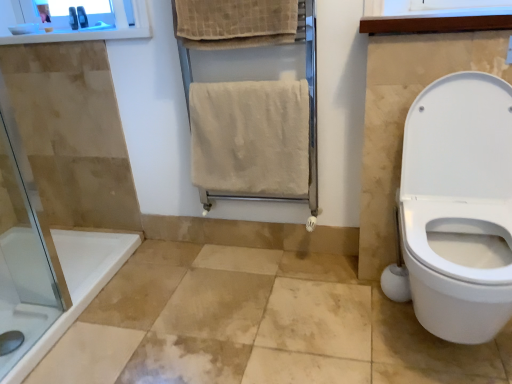
Describe the element at coordinates (250, 138) in the screenshot. This screenshot has height=384, width=512. I see `beige soft towel at center, which is the first bath towel from bottom to top` at that location.

Locate an element on the screen. This screenshot has height=384, width=512. white glossy toilet seat at right is located at coordinates (458, 207).

Describe the element at coordinates (312, 106) in the screenshot. I see `beige towel rack at center` at that location.

This screenshot has height=384, width=512. In order to click on white wood window frame at upper right in this screenshot , I will do `click(444, 7)`.

Measure the distance between point (424, 12) and camera.

4.36 feet.

In order to face beige textured towel at upper center, the 1th bath towel viewed from the top, should I rotate leftwards or rightwards?

You should look left and rotate roughly 2.733 degrees.

Find the location of a particular element. beige textured towel at upper center, the 2th bath towel ordered from the bottom is located at coordinates (234, 19).

Identify the location of wooden medicine cabinet at upper center. The image size is (512, 384). (431, 18).

Can you confirm if beige soft towel at center, the 2th bath towel in the top-to-bottom sequence, is thinner than wooden medicine cabinet at upper center?

Correct, the width of beige soft towel at center, the 2th bath towel in the top-to-bottom sequence, is less than that of wooden medicine cabinet at upper center.

Between beige soft towel at center, which is the first bath towel from bottom to top, and wooden medicine cabinet at upper center, which one appears on the left side from the viewer's perspective?

beige soft towel at center, which is the first bath towel from bottom to top, is more to the left.

Is beige soft towel at center, which is the first bath towel from bottom to top, aimed at wooden medicine cabinet at upper center?

No, beige soft towel at center, which is the first bath towel from bottom to top, is not aimed at wooden medicine cabinet at upper center.

From a real-world perspective, which is physically above, metallic gray razor at upper left, which appears as the second toiletry when viewed from the right, or white glossy toilet seat at right?

In real-world perspective, metallic gray razor at upper left, which appears as the second toiletry when viewed from the right, is above.

Which is more to the left, metallic gray razor at upper left, which appears as the second toiletry when viewed from the right, or white glossy toilet seat at right?

From the viewer's perspective, metallic gray razor at upper left, which appears as the second toiletry when viewed from the right, appears more on the left side.

Considering the relative sizes of metallic gray razor at upper left, which appears as the second toiletry when viewed from the right, and white glossy toilet seat at right in the image provided, is metallic gray razor at upper left, which appears as the second toiletry when viewed from the right, thinner than white glossy toilet seat at right?

Indeed, metallic gray razor at upper left, which appears as the second toiletry when viewed from the right, has a lesser width compared to white glossy toilet seat at right.

Can you tell me how much beige soft towel at center, which is the first bath towel from bottom to top, and metallic gray razor at upper left, arranged as the first toiletry when viewed from the left, differ in facing direction?

The facing directions of beige soft towel at center, which is the first bath towel from bottom to top, and metallic gray razor at upper left, arranged as the first toiletry when viewed from the left, are 16.3 degrees apart.

Considering the positions of objects beige soft towel at center, the 2th bath towel in the top-to-bottom sequence, and metallic gray razor at upper left, arranged as the first toiletry when viewed from the left, in the image provided, who is behind, beige soft towel at center, the 2th bath towel in the top-to-bottom sequence, or metallic gray razor at upper left, arranged as the first toiletry when viewed from the left,?

metallic gray razor at upper left, arranged as the first toiletry when viewed from the left, is further away from the camera.

Is metallic gray razor at upper left, which appears as the second toiletry when viewed from the right, surrounded by beige soft towel at center, the 2th bath towel in the top-to-bottom sequence?

Actually, metallic gray razor at upper left, which appears as the second toiletry when viewed from the right, is outside beige soft towel at center, the 2th bath towel in the top-to-bottom sequence.

From the image's perspective, is beige soft towel at center, which is the first bath towel from bottom to top, below metallic gray razor at upper left, which appears as the second toiletry when viewed from the right?

Yes, from the image's perspective, beige soft towel at center, which is the first bath towel from bottom to top, is beneath metallic gray razor at upper left, which appears as the second toiletry when viewed from the right.

Is wooden medicine cabinet at upper center beside white wood window frame at upper right?

Indeed, wooden medicine cabinet at upper center and white wood window frame at upper right are beside each other and touching.

From a real-world perspective, is wooden medicine cabinet at upper center over white wood window frame at upper right?

Actually, wooden medicine cabinet at upper center is physically below white wood window frame at upper right in the real world.

Does wooden medicine cabinet at upper center have a lesser width compared to white wood window frame at upper right?

Yes.

Can you confirm if wooden medicine cabinet at upper center is smaller than white wood window frame at upper right?

No.

Can beige towel rack at center be found inside matte plastic toothbrush at upper left, marked as the second toiletry in a left-to-right arrangement?

No, beige towel rack at center is not surrounded by matte plastic toothbrush at upper left, marked as the second toiletry in a left-to-right arrangement.

From the image's perspective, does matte plastic toothbrush at upper left, the 1th toiletry positioned from the right, appear higher than beige towel rack at center?

Yes, from the image's perspective, matte plastic toothbrush at upper left, the 1th toiletry positioned from the right, is above beige towel rack at center.

Considering the relative positions of matte plastic toothbrush at upper left, marked as the second toiletry in a left-to-right arrangement, and beige towel rack at center in the image provided, is matte plastic toothbrush at upper left, marked as the second toiletry in a left-to-right arrangement, to the left of beige towel rack at center from the viewer's perspective?

Yes, matte plastic toothbrush at upper left, marked as the second toiletry in a left-to-right arrangement, is to the left of beige towel rack at center.

Is matte plastic toothbrush at upper left, the 1th toiletry positioned from the right, beside beige towel rack at center?

No, matte plastic toothbrush at upper left, the 1th toiletry positioned from the right, is not in contact with beige towel rack at center.

From the image's perspective, who appears lower, white wood window frame at upper right or metallic gray razor at upper left, which appears as the second toiletry when viewed from the right?

From the image's view, white wood window frame at upper right is below.

Is white wood window frame at upper right next to metallic gray razor at upper left, arranged as the first toiletry when viewed from the left?

No.

From a real-world perspective, relative to metallic gray razor at upper left, which appears as the second toiletry when viewed from the right, is white wood window frame at upper right vertically above or below?

Clearly, from a real-world perspective, white wood window frame at upper right is below metallic gray razor at upper left, which appears as the second toiletry when viewed from the right.

Based on their positions, is white wood window frame at upper right located to the left or right of metallic gray razor at upper left, arranged as the first toiletry when viewed from the left?

white wood window frame at upper right is positioned on metallic gray razor at upper left, arranged as the first toiletry when viewed from the left,'s right side.

Which of these two, metallic gray razor at upper left, arranged as the first toiletry when viewed from the left, or white wood window frame at upper right, is smaller?

metallic gray razor at upper left, arranged as the first toiletry when viewed from the left, is smaller.

Is metallic gray razor at upper left, arranged as the first toiletry when viewed from the left, located outside white wood window frame at upper right?

metallic gray razor at upper left, arranged as the first toiletry when viewed from the left, is positioned outside white wood window frame at upper right.

Which object is more forward, metallic gray razor at upper left, arranged as the first toiletry when viewed from the left, or white wood window frame at upper right?

white wood window frame at upper right is in front.

The image size is (512, 384). Find the location of `bath towel below the wooden medicine cabinet at upper center (from the image's perspective)`. bath towel below the wooden medicine cabinet at upper center (from the image's perspective) is located at coordinates (250, 138).

Image resolution: width=512 pixels, height=384 pixels. In order to click on the 1st toiletry above the white glossy toilet seat at right (from the image's perspective) in this screenshot , I will do `click(73, 18)`.

Considering their positions, is metallic gray razor at upper left, which appears as the second toiletry when viewed from the right, positioned further to white wood window frame at upper right than matte plastic toothbrush at upper left, marked as the second toiletry in a left-to-right arrangement?

metallic gray razor at upper left, which appears as the second toiletry when viewed from the right, lies further to white wood window frame at upper right than the other object.

Which object lies further to the anchor point matte plastic toothbrush at upper left, marked as the second toiletry in a left-to-right arrangement, beige soft towel at center, which is the first bath towel from bottom to top, or beige towel rack at center?

beige soft towel at center, which is the first bath towel from bottom to top.

Looking at this image, considering their positions, is white wood window frame at upper right positioned closer to matte plastic toothbrush at upper left, the 1th toiletry positioned from the right, than beige soft towel at center, the 2th bath towel in the top-to-bottom sequence?

beige soft towel at center, the 2th bath towel in the top-to-bottom sequence.

Considering their positions, is white glossy toilet seat at right positioned closer to beige towel rack at center than beige soft towel at center, which is the first bath towel from bottom to top?

beige soft towel at center, which is the first bath towel from bottom to top.

From the picture: Looking at the image, which one is located further to beige textured towel at upper center, the 1th bath towel viewed from the top, white wood window frame at upper right or matte plastic toothbrush at upper left, marked as the second toiletry in a left-to-right arrangement?

matte plastic toothbrush at upper left, marked as the second toiletry in a left-to-right arrangement.

Based on their spatial positions, is beige textured towel at upper center, the 1th bath towel viewed from the top, or beige towel rack at center further from metallic gray razor at upper left, arranged as the first toiletry when viewed from the left?

Based on the image, beige towel rack at center appears to be further to metallic gray razor at upper left, arranged as the first toiletry when viewed from the left.

From the image, which object appears to be nearer to beige textured towel at upper center, the 2th bath towel ordered from the bottom, metallic gray razor at upper left, which appears as the second toiletry when viewed from the right, or wooden medicine cabinet at upper center?

wooden medicine cabinet at upper center is closer to beige textured towel at upper center, the 2th bath towel ordered from the bottom.

Looking at the image, which one is located closer to metallic gray razor at upper left, arranged as the first toiletry when viewed from the left, white glossy toilet seat at right or wooden medicine cabinet at upper center?

Among the two, wooden medicine cabinet at upper center is located nearer to metallic gray razor at upper left, arranged as the first toiletry when viewed from the left.

This screenshot has height=384, width=512. In order to click on screen door situated between beige textured towel at upper center, the 2th bath towel ordered from the bottom, and white wood window frame at upper right from left to right in this screenshot , I will do `click(312, 106)`.

The image size is (512, 384). Identify the location of medicine cabinet between beige towel rack at center and white glossy toilet seat at right. (431, 18).

Where is `toiletry between metallic gray razor at upper left, arranged as the first toiletry when viewed from the left, and white glossy toilet seat at right, in the horizontal direction`? This screenshot has height=384, width=512. toiletry between metallic gray razor at upper left, arranged as the first toiletry when viewed from the left, and white glossy toilet seat at right, in the horizontal direction is located at coordinates (82, 17).

This screenshot has width=512, height=384. I want to click on screen door located between matte plastic toothbrush at upper left, the 1th toiletry positioned from the right, and white wood window frame at upper right in the left-right direction, so click(x=312, y=106).